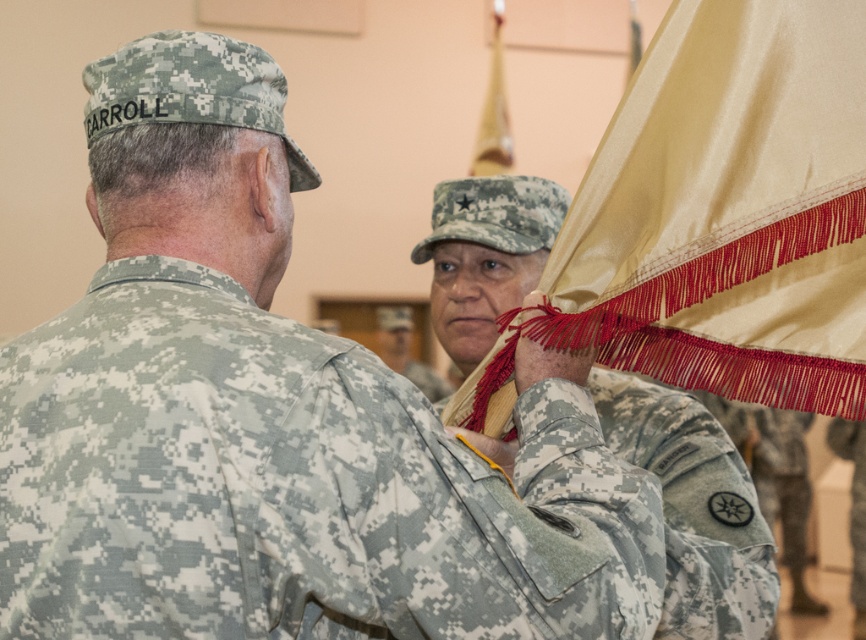
In the scene shown: You are attending a military ceremony and want to take a photo of the camouflage fabric uniform at upper right and the camouflage uniform at center. Which one will appear larger in your photo?

The camouflage fabric uniform at upper right will appear larger in the photo because it is closer to the viewer than the camouflage uniform at center.

In the scene shown: You are a photographer at the ceremony and need to capture a clear photo of the medal recipient. Since the camouflage fabric flag at center and the camouflage uniform at center are both in the frame, which object should you adjust to ensure the medal recipient is visible?

The camouflage fabric flag at center is larger than the camouflage uniform at center, so adjusting the camouflage fabric flag at center would be necessary to ensure the medal recipient is visible.